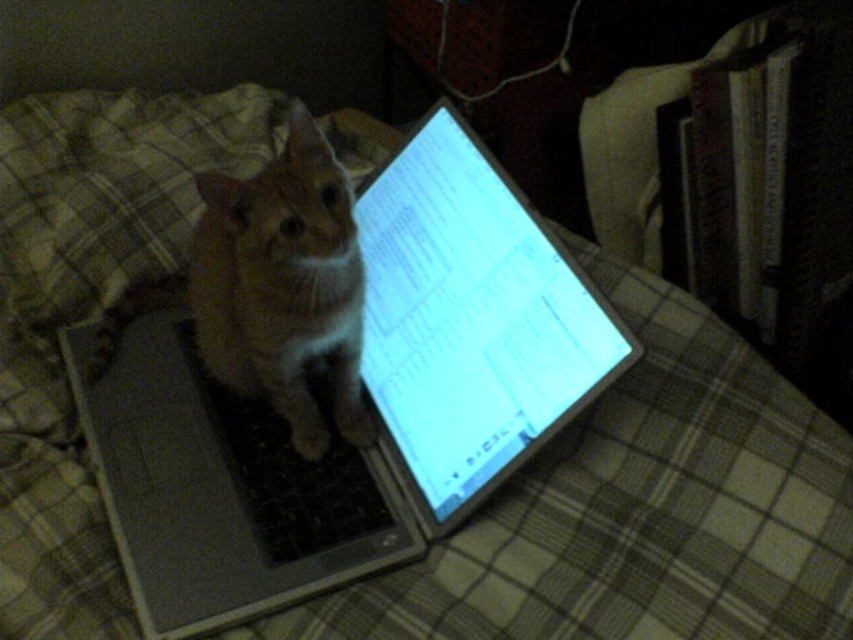
Question: From the image, what is the correct spatial relationship of silver metallic laptop at center in relation to black matte keyboard at center?

Choices:
 (A) left
 (B) right

Answer: (B)

Question: Which point appears closest to the camera in this image?

Choices:
 (A) (265, 362)
 (B) (363, 486)
 (C) (404, 324)

Answer: (A)

Question: Which point is closer to the camera?

Choices:
 (A) orange fur tabby cat at center
 (B) silver metallic laptop at center

Answer: (B)

Question: Which is nearer to the silver metallic laptop at center?

Choices:
 (A) orange fur tabby cat at center
 (B) black matte keyboard at center

Answer: (A)

Question: Where is silver metallic laptop at center located in relation to orange fur tabby cat at center in the image?

Choices:
 (A) right
 (B) left

Answer: (A)

Question: Can you confirm if orange fur tabby cat at center is positioned below black matte keyboard at center?

Choices:
 (A) yes
 (B) no

Answer: (B)